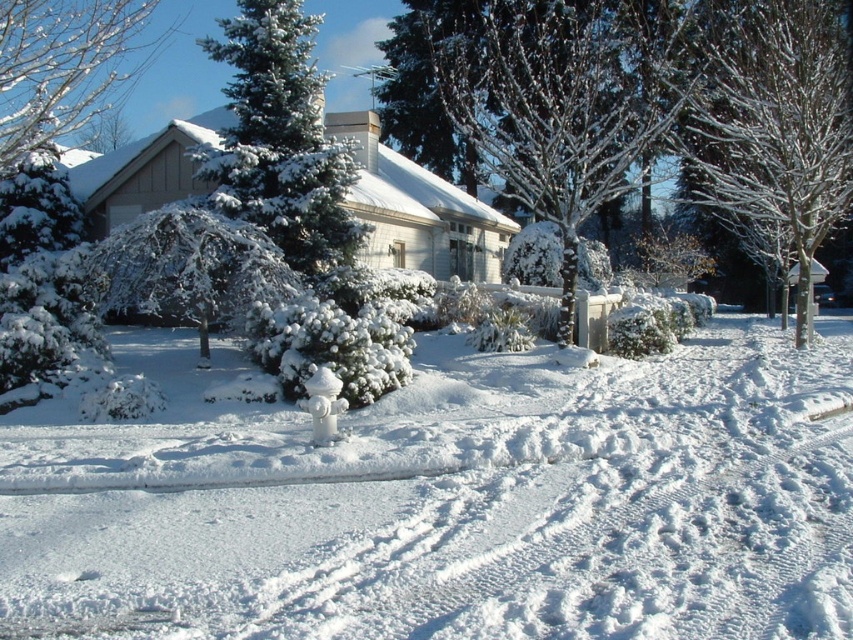
You are standing at the entrance of the house and want to locate the frosty bark tree at center. According to the scene description, where would you find it?

The frosty bark tree at center is located at point (560, 99), so you would find it at that coordinate position.

You are a mail carrier who needs to deliver a package to the house. You see the white fluffy snow at center and the frosty bark tree at center. Which object is closer to the house?

The white fluffy snow at center is smaller than the frosty bark tree at center, but this does not indicate their proximity to the house. The scene description mentions the house is partially obscured by snow laden trees and shrubs, so it is unclear which object is closer to the house based on the given information.

You are planning to build a snowman using the white fluffy snow at center and need to check if there is enough space between it and the frosty bark tree at center. Can you determine if the snow is wide enough to accommodate the snowman without touching the tree?

The white fluffy snow at center might be wider than frosty bark tree at center, so there is a possibility that the snow area is wide enough to build the snowman without touching the tree. However, the exact width isn t specified, so it s recommended to measure the distance before building.